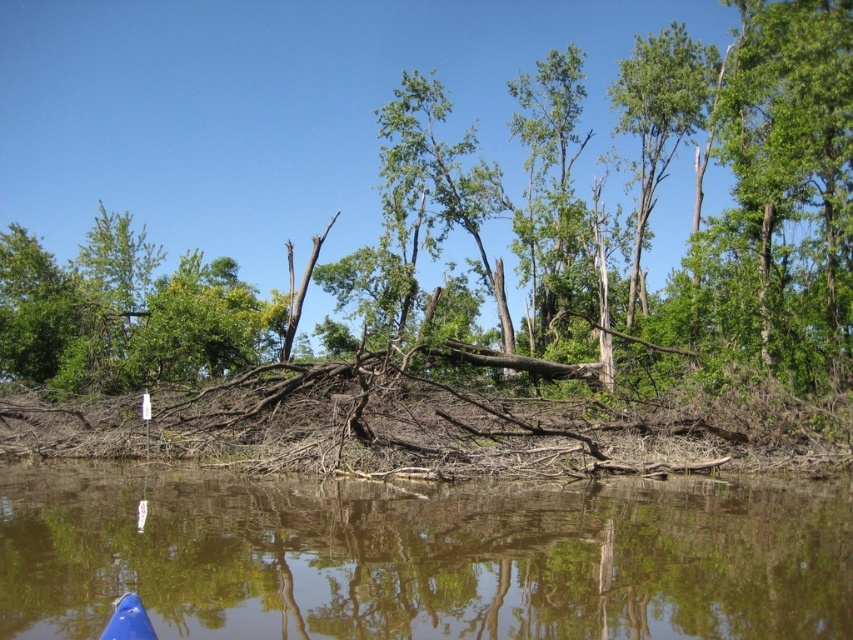
Question: Is brown rough wood at center above brown wood at lower center?

Choices:
 (A) no
 (B) yes

Answer: (B)

Question: Which point appears closest to the camera in this image?

Choices:
 (A) (440, 593)
 (B) (405, 45)

Answer: (A)

Question: Which point appears farthest from the camera in this image?

Choices:
 (A) click(x=786, y=486)
 (B) click(x=412, y=170)

Answer: (B)

Question: Which point is closer to the camera taking this photo?

Choices:
 (A) (492, 515)
 (B) (624, 12)

Answer: (A)

Question: Where is brown rough wood at center located in relation to brown wood at lower center in the image?

Choices:
 (A) below
 (B) above

Answer: (B)

Question: Does brown rough wood at center have a greater width compared to brown wood at lower center?

Choices:
 (A) yes
 (B) no

Answer: (A)